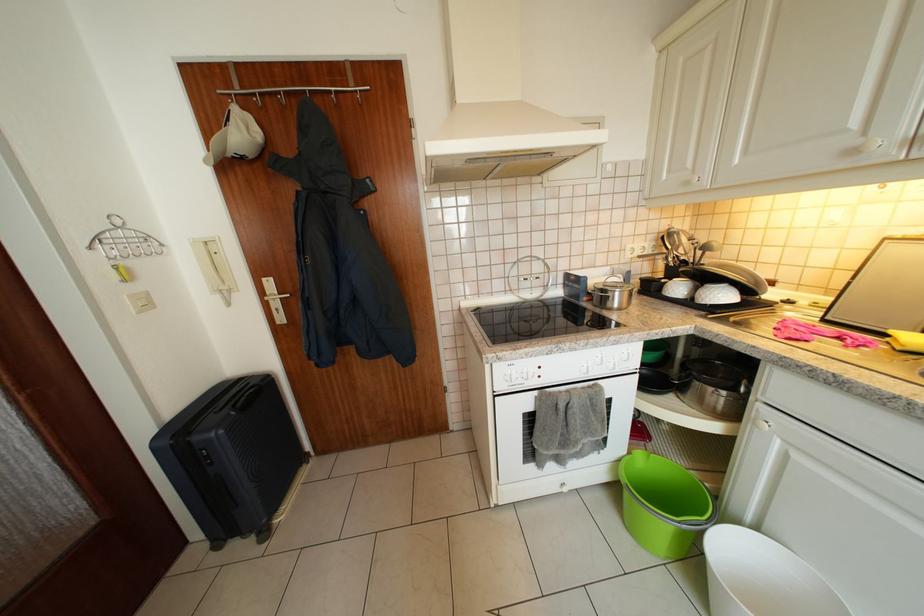
At what (x,y) coordinates should I click in order to perform the action: click on white plastic bin. Please return your answer as a coordinate pair (x, y). The width and height of the screenshot is (924, 616). Looking at the image, I should click on (761, 578).